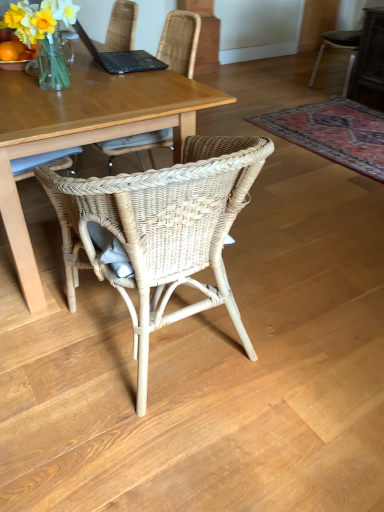
Question: Is point (370, 72) positioned closer to the camera than point (258, 117)?

Choices:
 (A) farther
 (B) closer

Answer: (A)

Question: From the image's perspective, relative to carpet with intricate pattern at lower right, is dark gray fabric chair at upper right, acting as the first chair starting from the back, above or below?

Choices:
 (A) above
 (B) below

Answer: (A)

Question: Estimate the real-world distances between objects in this image. Which object is farther from the carpet with intricate pattern at lower right?

Choices:
 (A) woven rattan chair at center, which is the first chair in left-to-right order
 (B) matte wooden desk at center
 (C) dark gray fabric chair at upper right, which is the first chair in right-to-left order
 (D) translucent glass vase at upper left

Answer: (D)

Question: Estimate the real-world distances between objects in this image. Which object is farther from the woven rattan chair at center, which is the first chair in left-to-right order?

Choices:
 (A) carpet with intricate pattern at lower right
 (B) dark gray fabric chair at upper right, acting as the first chair starting from the back
 (C) translucent glass vase at upper left
 (D) matte wooden desk at center

Answer: (B)